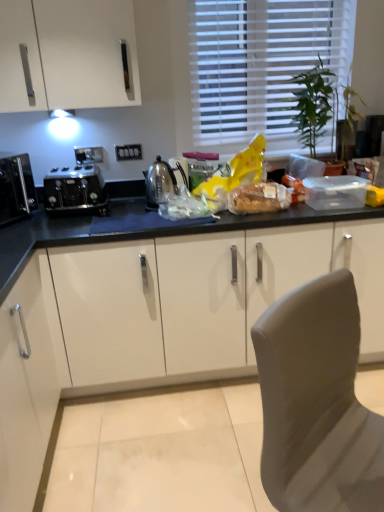
Consider the image. Measure the distance between black glossy microwave at left, the 1th kitchen appliance viewed from the left, and camera.

The distance of black glossy microwave at left, the 1th kitchen appliance viewed from the left, from camera is 6.26 feet.

I want to click on black glossy microwave at left, marked as the 2th kitchen appliance in a right-to-left arrangement, so click(16, 187).

Describe the element at coordinates (134, 314) in the screenshot. I see `white matte cabinet at lower left` at that location.

At what (x,y) coordinates should I click in order to perform the action: click on white matte cabinet at lower left. Please return your answer as a coordinate pair (x, y). This screenshot has height=512, width=384. Looking at the image, I should click on (134, 314).

The height and width of the screenshot is (512, 384). Identify the location of black metallic toaster at left, which appears as the first kitchen appliance when viewed from the right. (75, 191).

At what (x,y) coordinates should I click in order to perform the action: click on green leafy plant at upper right. Please return your answer as a coordinate pair (x, y). This screenshot has height=512, width=384. Looking at the image, I should click on (312, 104).

From a real-world perspective, is matte brown bread at center, which is the 1th food in right-to-left order, on white matte cabinet at lower left?

Yes, from a real-world perspective, matte brown bread at center, which is the 1th food in right-to-left order, is on top of white matte cabinet at lower left.

What's the angular difference between matte brown bread at center, positioned as the second food in left-to-right order, and white matte cabinet at lower left's facing directions?

matte brown bread at center, positioned as the second food in left-to-right order, and white matte cabinet at lower left are facing 90.4 degrees away from each other.

The height and width of the screenshot is (512, 384). I want to click on cabinetry below the matte brown bread at center, which is the 1th food in right-to-left order (from a real-world perspective), so click(134, 314).

From the image's perspective, who appears lower, matte brown bread at center, positioned as the second food in left-to-right order, or white matte cabinet at lower left?

white matte cabinet at lower left, from the image's perspective.

Is white matte cabinet at lower left inside the boundaries of green leafy plant at upper right, or outside?

white matte cabinet at lower left is outside green leafy plant at upper right.

Measure the distance between white matte cabinet at lower left and green leafy plant at upper right.

white matte cabinet at lower left is 1.08 meters from green leafy plant at upper right.

Are white matte cabinet at lower left and green leafy plant at upper right making contact?

No, white matte cabinet at lower left is not making contact with green leafy plant at upper right.

Does white matte cabinet at lower left come behind green leafy plant at upper right?

No, white matte cabinet at lower left is closer to the viewer.

Who is taller, black metallic toaster at left, which appears as the first kitchen appliance when viewed from the right, or black glossy microwave at left, the 1th kitchen appliance viewed from the left?

Standing taller between the two is black glossy microwave at left, the 1th kitchen appliance viewed from the left.

Is black metallic toaster at left, the second kitchen appliance positioned from the left, next to black glossy microwave at left, marked as the 2th kitchen appliance in a right-to-left arrangement?

No, black metallic toaster at left, the second kitchen appliance positioned from the left, is not with black glossy microwave at left, marked as the 2th kitchen appliance in a right-to-left arrangement.

Looking at this image, who is bigger, black metallic toaster at left, which appears as the first kitchen appliance when viewed from the right, or black glossy microwave at left, marked as the 2th kitchen appliance in a right-to-left arrangement?

black glossy microwave at left, marked as the 2th kitchen appliance in a right-to-left arrangement, is bigger.

Is the depth of black metallic toaster at left, the second kitchen appliance positioned from the left, less than that of black glossy microwave at left, marked as the 2th kitchen appliance in a right-to-left arrangement?

No, black metallic toaster at left, the second kitchen appliance positioned from the left, is further to the viewer.

Is point (7, 180) positioned after point (316, 133)?

No, it is in front of (316, 133).

From the image's perspective, who appears lower, black glossy microwave at left, marked as the 2th kitchen appliance in a right-to-left arrangement, or green leafy plant at upper right?

black glossy microwave at left, marked as the 2th kitchen appliance in a right-to-left arrangement, from the image's perspective.

From a real-world perspective, who is located lower, black glossy microwave at left, marked as the 2th kitchen appliance in a right-to-left arrangement, or green leafy plant at upper right?

black glossy microwave at left, marked as the 2th kitchen appliance in a right-to-left arrangement, is physically lower.

What are the coordinates of `the 1st kitchen appliance positioned below the green leafy plant at upper right (from a real-world perspective)` in the screenshot? It's located at (16, 187).

From a real-world perspective, is translucent plastic bag at center, positioned as the second food in right-to-left order, under matte brown bread at center, which is the 1th food in right-to-left order?

Yes, from a real-world perspective, translucent plastic bag at center, positioned as the second food in right-to-left order, is beneath matte brown bread at center, which is the 1th food in right-to-left order.

Considering the sizes of objects translucent plastic bag at center, positioned as the second food in right-to-left order, and matte brown bread at center, positioned as the second food in left-to-right order, in the image provided, who is smaller, translucent plastic bag at center, positioned as the second food in right-to-left order, or matte brown bread at center, positioned as the second food in left-to-right order,?

translucent plastic bag at center, positioned as the second food in right-to-left order, is smaller.

Are translucent plastic bag at center, marked as the first food in a left-to-right arrangement, and matte brown bread at center, which is the 1th food in right-to-left order, located far from each other?

translucent plastic bag at center, marked as the first food in a left-to-right arrangement, is actually quite close to matte brown bread at center, which is the 1th food in right-to-left order.

Does point (163, 193) appear closer or farther from the camera than point (155, 184)?

Clearly, point (163, 193) is closer to the camera than point (155, 184).

From the image's perspective, is translucent plastic bag at center, positioned as the second food in right-to-left order, over satin silver kettle at center?

No, from the image's perspective, translucent plastic bag at center, positioned as the second food in right-to-left order, is not over satin silver kettle at center.

Is translucent plastic bag at center, positioned as the second food in right-to-left order, to the right of satin silver kettle at center from the viewer's perspective?

Indeed, translucent plastic bag at center, positioned as the second food in right-to-left order, is positioned on the right side of satin silver kettle at center.

Is white blinds at upper center not close to white matte cabinet at lower left?

Indeed, white blinds at upper center is not near white matte cabinet at lower left.

Is white blinds at upper center taller than white matte cabinet at lower left?

Correct, white blinds at upper center is much taller as white matte cabinet at lower left.

From a real-world perspective, is white blinds at upper center positioned above or below white matte cabinet at lower left?

Clearly, from a real-world perspective, white blinds at upper center is above white matte cabinet at lower left.

From the image's perspective, is white blinds at upper center above or below white matte cabinet at lower left?

From the image's perspective, white blinds at upper center appears above white matte cabinet at lower left.

From the image's perspective, which food is the 2nd one above the white matte cabinet at lower left? Please provide its 2D coordinates.

[(259, 198)]

The image size is (384, 512). I want to click on cabinetry lying in front of the green leafy plant at upper right, so click(x=134, y=314).

Considering their positions, is translucent plastic bag at center, marked as the first food in a left-to-right arrangement, positioned closer to green leafy plant at upper right than black glossy microwave at left, the 1th kitchen appliance viewed from the left?

translucent plastic bag at center, marked as the first food in a left-to-right arrangement, lies closer to green leafy plant at upper right than the other object.

Estimate the real-world distances between objects in this image. Which object is closer to white matte cabinet at lower left, black metallic toaster at left, which appears as the first kitchen appliance when viewed from the right, or green leafy plant at upper right?

The object closer to white matte cabinet at lower left is black metallic toaster at left, which appears as the first kitchen appliance when viewed from the right.

From the image, which object appears to be farther from black metallic toaster at left, the second kitchen appliance positioned from the left, black glossy microwave at left, marked as the 2th kitchen appliance in a right-to-left arrangement, or translucent plastic bag at center, positioned as the second food in right-to-left order?

translucent plastic bag at center, positioned as the second food in right-to-left order, lies further to black metallic toaster at left, the second kitchen appliance positioned from the left, than the other object.

Considering their positions, is black glossy microwave at left, marked as the 2th kitchen appliance in a right-to-left arrangement, positioned closer to white blinds at upper center than satin silver kettle at center?

Among the two, satin silver kettle at center is located nearer to white blinds at upper center.

Looking at the image, which one is located closer to matte brown bread at center, positioned as the second food in left-to-right order, white matte cabinet at lower left or translucent plastic bag at center, positioned as the second food in right-to-left order?

translucent plastic bag at center, positioned as the second food in right-to-left order, lies closer to matte brown bread at center, positioned as the second food in left-to-right order, than the other object.

Based on their spatial positions, is green leafy plant at upper right or translucent plastic bag at center, positioned as the second food in right-to-left order, closer to satin silver kettle at center?

Based on the image, translucent plastic bag at center, positioned as the second food in right-to-left order, appears to be nearer to satin silver kettle at center.

Which object lies further to the anchor point translucent plastic bag at center, marked as the first food in a left-to-right arrangement, green leafy plant at upper right or matte brown bread at center, which is the 1th food in right-to-left order?

green leafy plant at upper right.

Looking at the image, which one is located further to white matte cabinet at lower left, matte brown bread at center, positioned as the second food in left-to-right order, or black metallic toaster at left, the second kitchen appliance positioned from the left?

The object further to white matte cabinet at lower left is matte brown bread at center, positioned as the second food in left-to-right order.

The image size is (384, 512). In order to click on plant between white blinds at upper center and matte brown bread at center, which is the 1th food in right-to-left order, in the up-down direction in this screenshot , I will do point(312,104).

I want to click on appliance located between black glossy microwave at left, the 1th kitchen appliance viewed from the left, and green leafy plant at upper right in the left-right direction, so click(x=158, y=182).

Locate an element on the screen. The image size is (384, 512). appliance between white blinds at upper center and white matte cabinet at lower left from top to bottom is located at coordinates [158, 182].

This screenshot has width=384, height=512. Find the location of `appliance between white blinds at upper center and matte brown bread at center, positioned as the second food in left-to-right order, in the vertical direction`. appliance between white blinds at upper center and matte brown bread at center, positioned as the second food in left-to-right order, in the vertical direction is located at coordinates (158, 182).